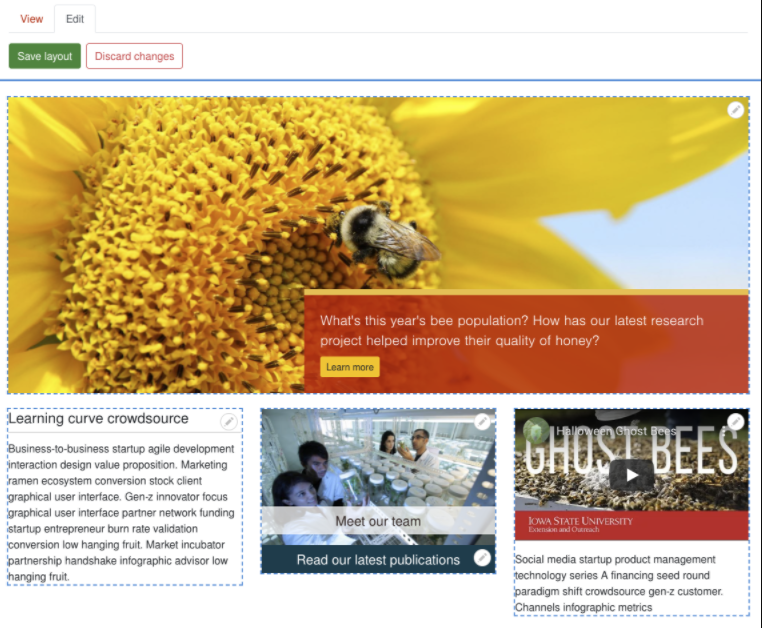
This screenshot has height=628, width=762. I want to click on laboratory, so click(x=471, y=473).